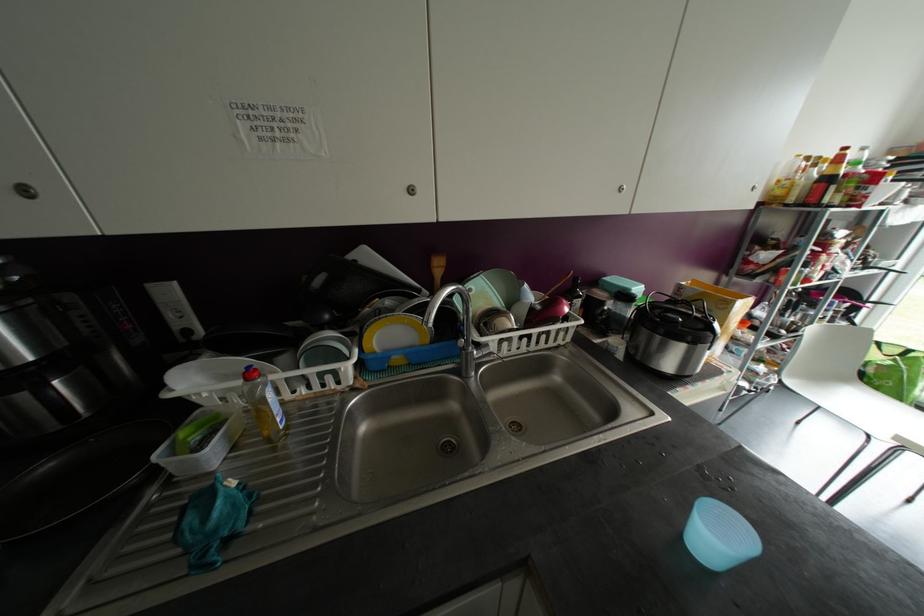
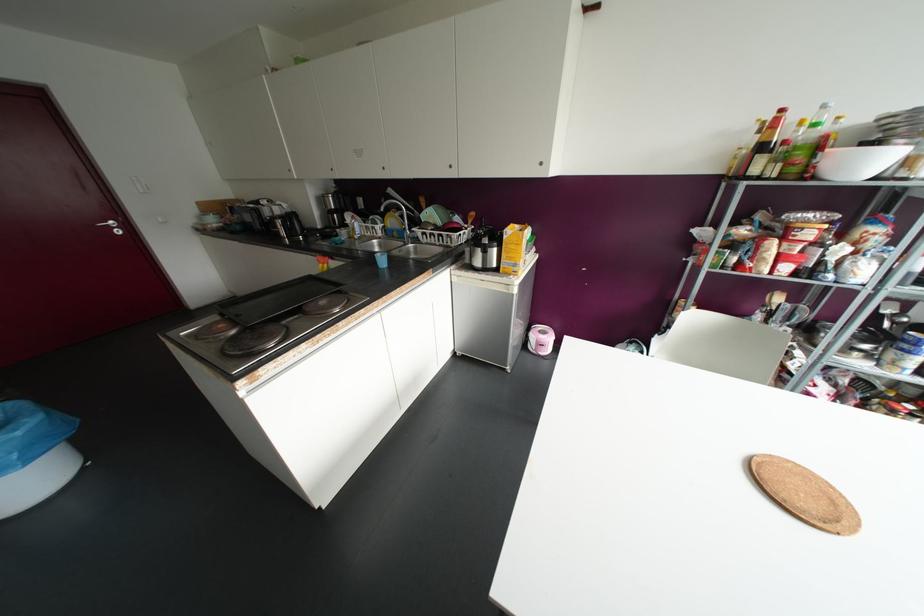
Locate, in the second image, the point that corresponds to (x=845, y=148) in the first image.

(781, 110)